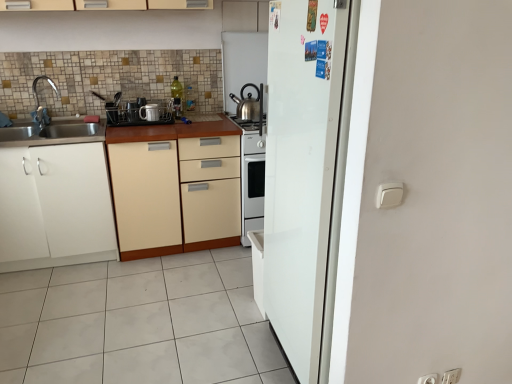
Locate an element on the screen. blank space situated above stainless steel kettle at center, which ranks as the first appliance in right-to-left order (from a real-world perspective) is located at coordinates (244, 30).